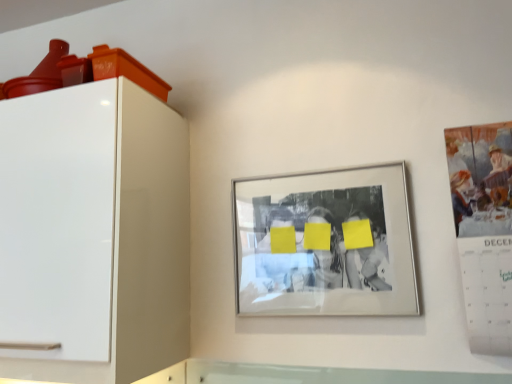
Question: From the image's perspective, relative to matte paper calendar at right, is white glossy cabinet at left above or below?

Choices:
 (A) above
 (B) below

Answer: (B)

Question: Considering their positions, is white glossy cabinet at left located in front of or behind matte paper calendar at right?

Choices:
 (A) behind
 (B) front

Answer: (B)

Question: Which is farther from the matte paper calendar at right?

Choices:
 (A) silver metallic picture frame at center
 (B) white glossy cabinet at left

Answer: (B)

Question: Estimate the real-world distances between objects in this image. Which object is closer to the matte paper calendar at right?

Choices:
 (A) silver metallic picture frame at center
 (B) white glossy cabinet at left

Answer: (A)